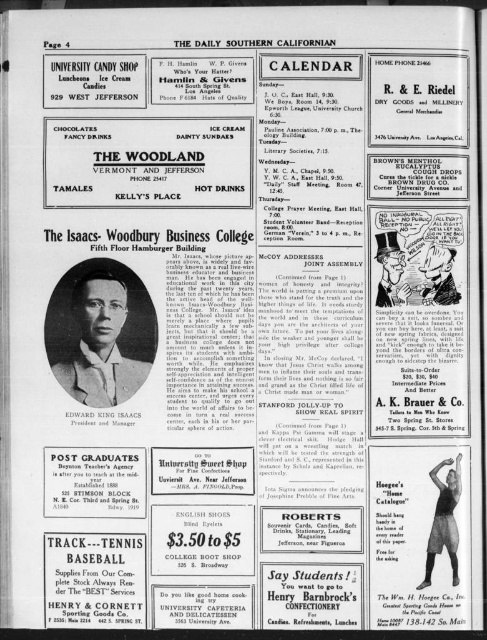
Between black fabric mannequin at center and matte red tie at center, which one appears on the left side from the viewer's perspective?

From the viewer's perspective, matte red tie at center appears more on the left side.

Is black fabric mannequin at center shorter than matte red tie at center?

No, black fabric mannequin at center is not shorter than matte red tie at center.

Find the location of a particular element. black fabric mannequin at center is located at coordinates (444, 518).

Which is below, black paper portrait at center or matte red tie at center?

black paper portrait at center is below.

Based on the photo, how much distance is there between black paper portrait at center and matte red tie at center?

black paper portrait at center and matte red tie at center are 11.92 inches apart from each other.

Locate an element on the screen. This screenshot has width=487, height=640. black paper portrait at center is located at coordinates (104, 342).

The width and height of the screenshot is (487, 640). Identify the location of black paper portrait at center. (104, 342).

Consider the image. Can you confirm if black paper portrait at center is wider than black fabric mannequin at center?

Yes.

Between black paper portrait at center and black fabric mannequin at center, which one has less height?

black fabric mannequin at center is shorter.

Between point (118, 289) and point (434, 536), which one is positioned in front?

Point (434, 536) is more forward.

You are a GUI agent. You are given a task and a screenshot of the screen. Output one action in this format:
    pyautogui.click(x=<x>, y=<y>)
    Task: Click on the black paper portrait at center
    The width and height of the screenshot is (487, 640).
    Given the screenshot: What is the action you would take?
    [104, 342]